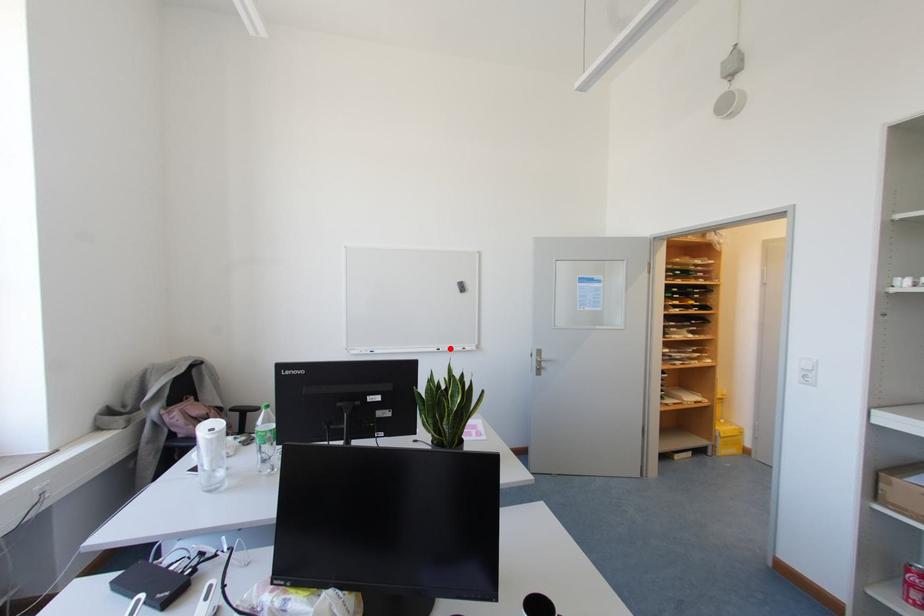
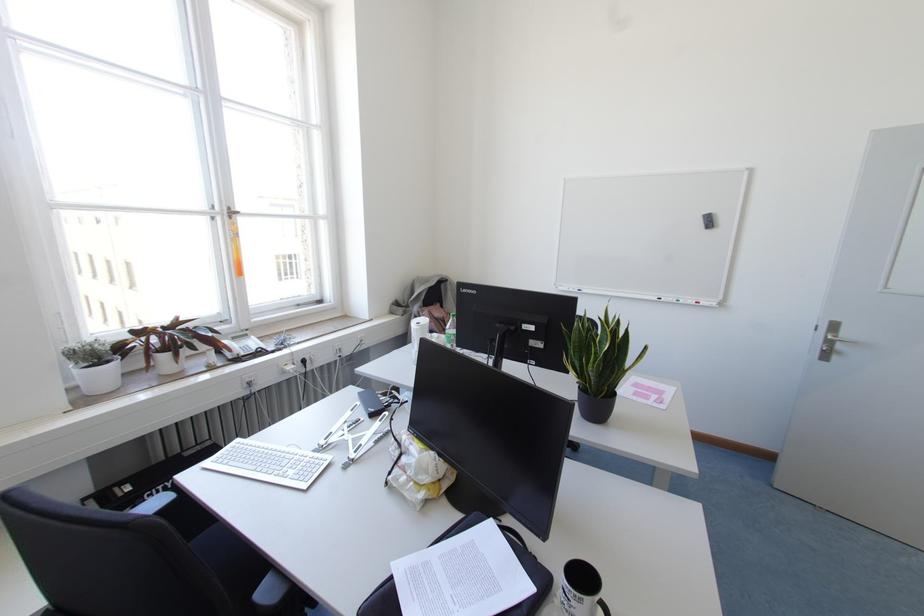
Locate, in the second image, the point that corresponds to the highlighted location in the first image.

(676, 300)